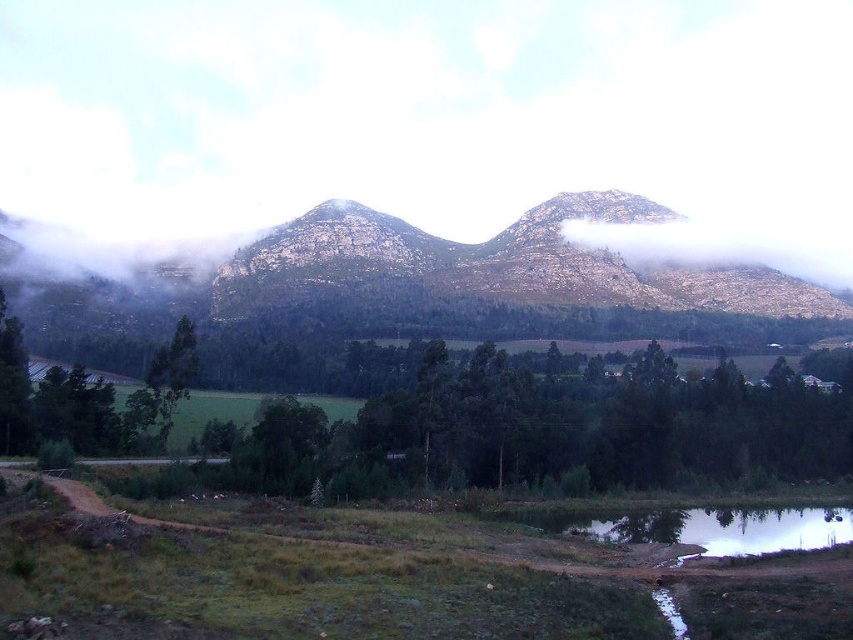
Question: Does green leafy trees at center appear under smooth reflective water at bottom right?

Choices:
 (A) no
 (B) yes

Answer: (A)

Question: Is white foggy mountain at upper center positioned in front of green leafy trees at center?

Choices:
 (A) yes
 (B) no

Answer: (B)

Question: Does green leafy trees at center appear under smooth reflective water at bottom right?

Choices:
 (A) yes
 (B) no

Answer: (B)

Question: Based on their relative distances, which object is nearer to the green leafy trees at center?

Choices:
 (A) rugged stone mountain at center
 (B) white foggy mountain at upper center
 (C) smooth reflective water at bottom right

Answer: (C)

Question: Which object is the closest to the smooth reflective water at bottom right?

Choices:
 (A) green leafy trees at center
 (B) rugged stone mountain at center
 (C) white foggy mountain at upper center

Answer: (A)

Question: Which object is positioned closest to the green leafy trees at center?

Choices:
 (A) white foggy mountain at upper center
 (B) rugged stone mountain at center

Answer: (B)